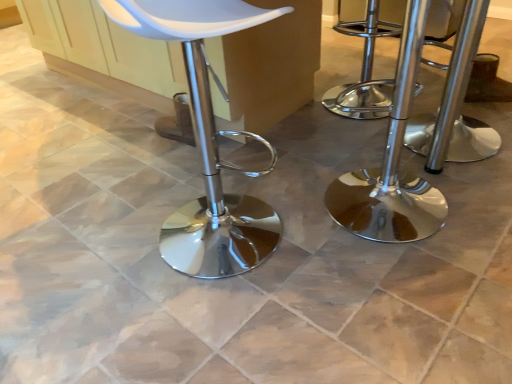
The width and height of the screenshot is (512, 384). Identify the location of free point in front of chrome/metallic stool at right, the second stool positioned from the right. (411, 290).